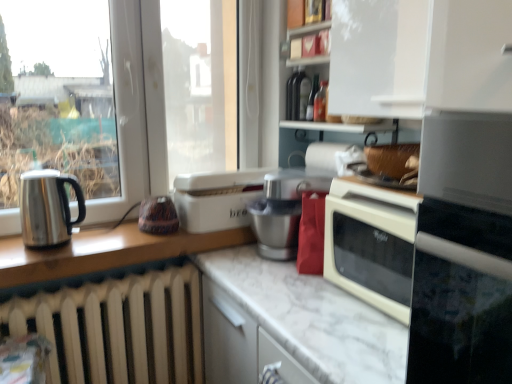
Question: Is stainless steel kettle at left, which is the second kitchen appliance in right-to-left order, taller than white plastic bread bin at center, marked as the first kitchen appliance in a right-to-left arrangement?

Choices:
 (A) yes
 (B) no

Answer: (A)

Question: Is there a large distance between stainless steel kettle at left, the first kitchen appliance from the front, and white plastic bread bin at center, marked as the first kitchen appliance in a right-to-left arrangement?

Choices:
 (A) yes
 (B) no

Answer: (B)

Question: Does stainless steel kettle at left, the first kitchen appliance from the front, have a lesser height compared to white plastic bread bin at center, which is the 1th kitchen appliance from back to front?

Choices:
 (A) yes
 (B) no

Answer: (B)

Question: Is stainless steel kettle at left, which is the second kitchen appliance in right-to-left order, facing towards white plastic bread bin at center, the 2th kitchen appliance when ordered from left to right?

Choices:
 (A) no
 (B) yes

Answer: (A)

Question: From the image's perspective, is stainless steel kettle at left, which ranks as the second kitchen appliance in back-to-front order, beneath white plastic bread bin at center, marked as the first kitchen appliance in a right-to-left arrangement?

Choices:
 (A) yes
 (B) no

Answer: (A)

Question: From the image's perspective, is stainless steel kettle at left, which is the second kitchen appliance in right-to-left order, positioned above or below metallic silver food processor at center?

Choices:
 (A) above
 (B) below

Answer: (A)

Question: Considering their positions, is stainless steel kettle at left, which ranks as the second kitchen appliance in back-to-front order, located in front of or behind metallic silver food processor at center?

Choices:
 (A) behind
 (B) front

Answer: (B)

Question: Is stainless steel kettle at left, marked as the 1th kitchen appliance in a left-to-right arrangement, situated inside metallic silver food processor at center or outside?

Choices:
 (A) outside
 (B) inside

Answer: (A)

Question: Is stainless steel kettle at left, marked as the 1th kitchen appliance in a left-to-right arrangement, to the left or to the right of metallic silver food processor at center in the image?

Choices:
 (A) left
 (B) right

Answer: (A)

Question: Is metallic silver food processor at center taller or shorter than white glossy shelf at upper center?

Choices:
 (A) short
 (B) tall

Answer: (A)

Question: From the image's perspective, is metallic silver food processor at center above or below white glossy shelf at upper center?

Choices:
 (A) below
 (B) above

Answer: (A)

Question: From a real-world perspective, is metallic silver food processor at center physically located above or below white glossy shelf at upper center?

Choices:
 (A) below
 (B) above

Answer: (A)

Question: Would you say metallic silver food processor at center is inside or outside white glossy shelf at upper center?

Choices:
 (A) inside
 (B) outside

Answer: (B)

Question: Based on their positions, is white matte cabinet at upper right located to the left or right of stainless steel kettle at left, the first kitchen appliance from the front?

Choices:
 (A) right
 (B) left

Answer: (A)

Question: In the image, is white matte cabinet at upper right positioned in front of or behind stainless steel kettle at left, which is the second kitchen appliance in right-to-left order?

Choices:
 (A) behind
 (B) front

Answer: (B)